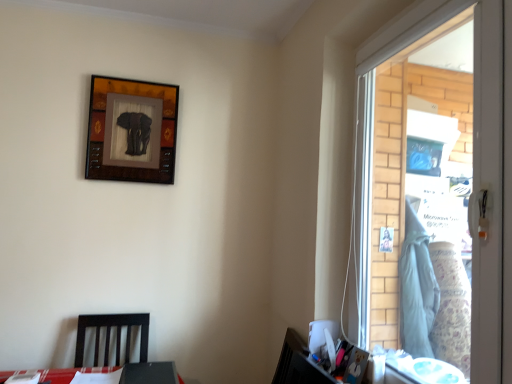
Identify the location of dark wood chair at lower left. (109, 335).

The image size is (512, 384). What do you see at coordinates (132, 130) in the screenshot?
I see `wooden elephant art at upper left` at bounding box center [132, 130].

Locate an element on the screen. dark wood chair at lower left is located at coordinates (109, 335).

Is wooden elephant art at upper left in contact with dark wood chair at lower left?

They are not placed beside each other.

Identify the location of furniture on the left of wooden elephant art at upper left. (109, 335).

Does wooden elephant art at upper left turn towards dark wood chair at lower left?

No, wooden elephant art at upper left does not turn towards dark wood chair at lower left.

Is dark wood chair at lower left wider or thinner than wooden elephant art at upper left?

Considering their sizes, dark wood chair at lower left looks broader than wooden elephant art at upper left.

From the image's perspective, is dark wood chair at lower left above or below wooden elephant art at upper left?

Clearly, from the image's perspective, dark wood chair at lower left is below wooden elephant art at upper left.

Is dark wood chair at lower left taller or shorter than wooden elephant art at upper left?

dark wood chair at lower left is shorter than wooden elephant art at upper left.

Identify the location of picture frame above the dark wood chair at lower left (from a real-world perspective). point(132,130).

Where is `picture frame above the clear glass window at right (from a real-world perspective)`? Image resolution: width=512 pixels, height=384 pixels. picture frame above the clear glass window at right (from a real-world perspective) is located at coordinates (132, 130).

Is the depth of wooden elephant art at upper left greater than that of clear glass window at right?

That is True.

Is wooden elephant art at upper left located outside clear glass window at right?

Indeed, wooden elephant art at upper left is completely outside clear glass window at right.

Is wooden elephant art at upper left thinner than clear glass window at right?

Correct, the width of wooden elephant art at upper left is less than that of clear glass window at right.

Would you consider clear glass window at right to be distant from wooden elephant art at upper left?

Yes, clear glass window at right and wooden elephant art at upper left are quite far apart.

How far apart are clear glass window at right and wooden elephant art at upper left?

The distance of clear glass window at right from wooden elephant art at upper left is 4.16 feet.

From a real-world perspective, is clear glass window at right positioned over wooden elephant art at upper left based on gravity?

Result: No, from a real-world perspective, clear glass window at right is not on top of wooden elephant art at upper left.

Which of these two, clear glass window at right or wooden elephant art at upper left, is wider?

clear glass window at right.

Considering the sizes of dark wood chair at lower left and clear glass window at right in the image, is dark wood chair at lower left taller or shorter than clear glass window at right?

Clearly, dark wood chair at lower left is shorter compared to clear glass window at right.

Between dark wood chair at lower left and clear glass window at right, which one is positioned in front?

Positioned in front is clear glass window at right.

Could you tell me if dark wood chair at lower left is facing clear glass window at right?

No, dark wood chair at lower left is not turned towards clear glass window at right.

Identify the location of furniture located on the left of clear glass window at right. The height and width of the screenshot is (384, 512). coord(109,335).

Does clear glass window at right turn towards dark wood chair at lower left?

No, clear glass window at right is not turned towards dark wood chair at lower left.

Between clear glass window at right and dark wood chair at lower left, which one has more height?

With more height is clear glass window at right.

Considering the sizes of objects clear glass window at right and dark wood chair at lower left in the image provided, who is smaller, clear glass window at right or dark wood chair at lower left?

dark wood chair at lower left.

Find the location of a particular element. furniture below the wooden elephant art at upper left (from the image's perspective) is located at coordinates (109, 335).

This screenshot has width=512, height=384. Find the location of `furniture below the wooden elephant art at upper left (from a real-world perspective)`. furniture below the wooden elephant art at upper left (from a real-world perspective) is located at coordinates (109, 335).

Estimate the real-world distances between objects in this image. Which object is closer to wooden elephant art at upper left, clear glass window at right or dark wood chair at lower left?

Based on the image, dark wood chair at lower left appears to be nearer to wooden elephant art at upper left.

When comparing their distances from wooden elephant art at upper left, does dark wood chair at lower left or clear glass window at right seem further?

Based on the image, clear glass window at right appears to be further to wooden elephant art at upper left.

When comparing their distances from dark wood chair at lower left, does wooden elephant art at upper left or clear glass window at right seem further?

The object further to dark wood chair at lower left is clear glass window at right.

Which object lies further to the anchor point dark wood chair at lower left, clear glass window at right or wooden elephant art at upper left?

clear glass window at right lies further to dark wood chair at lower left than the other object.

Based on their spatial positions, is wooden elephant art at upper left or dark wood chair at lower left further from clear glass window at right?

dark wood chair at lower left is further to clear glass window at right.

Which object lies nearer to the anchor point clear glass window at right, dark wood chair at lower left or wooden elephant art at upper left?

wooden elephant art at upper left lies closer to clear glass window at right than the other object.

This screenshot has width=512, height=384. Find the location of `picture frame between dark wood chair at lower left and clear glass window at right`. picture frame between dark wood chair at lower left and clear glass window at right is located at coordinates (132, 130).